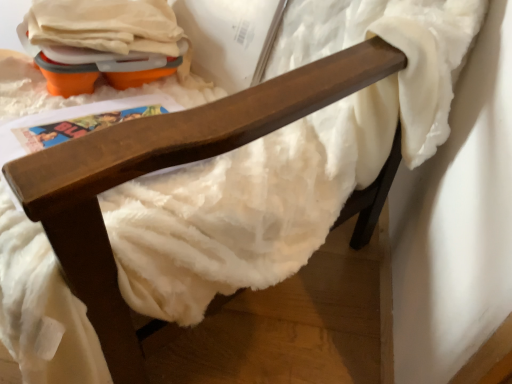
Question: Based on their sizes in the image, would you say wooden chair arm at upper center is bigger or smaller than orange plastic egg carton at upper left?

Choices:
 (A) big
 (B) small

Answer: (A)

Question: Is wooden chair arm at upper center wider or thinner than orange plastic egg carton at upper left?

Choices:
 (A) wide
 (B) thin

Answer: (A)

Question: From a real-world perspective, relative to orange plastic egg carton at upper left, is wooden chair arm at upper center vertically above or below?

Choices:
 (A) above
 (B) below

Answer: (B)

Question: Considering the positions of orange plastic egg carton at upper left and wooden chair arm at upper center in the image, is orange plastic egg carton at upper left wider or thinner than wooden chair arm at upper center?

Choices:
 (A) thin
 (B) wide

Answer: (A)

Question: Considering the positions of orange plastic egg carton at upper left and wooden chair arm at upper center in the image, is orange plastic egg carton at upper left bigger or smaller than wooden chair arm at upper center?

Choices:
 (A) big
 (B) small

Answer: (B)

Question: In the image, is orange plastic egg carton at upper left on the left side or the right side of wooden chair arm at upper center?

Choices:
 (A) right
 (B) left

Answer: (B)

Question: Relative to wooden chair arm at upper center, is orange plastic egg carton at upper left in front or behind?

Choices:
 (A) behind
 (B) front

Answer: (A)